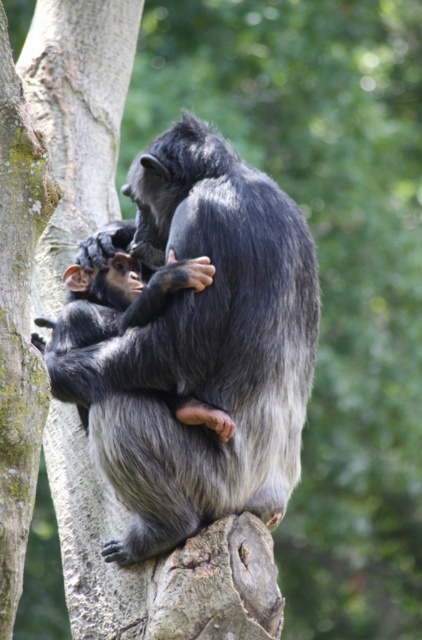
Question: In this image, where is gray furry monkey at center located relative to shiny black monkey at center?

Choices:
 (A) below
 (B) above

Answer: (B)

Question: Which point is closer to the camera?

Choices:
 (A) gray furry monkey at center
 (B) shiny black monkey at center

Answer: (A)

Question: Is gray furry monkey at center positioned before shiny black monkey at center?

Choices:
 (A) no
 (B) yes

Answer: (B)

Question: Does gray furry monkey at center appear over shiny black monkey at center?

Choices:
 (A) yes
 (B) no

Answer: (A)